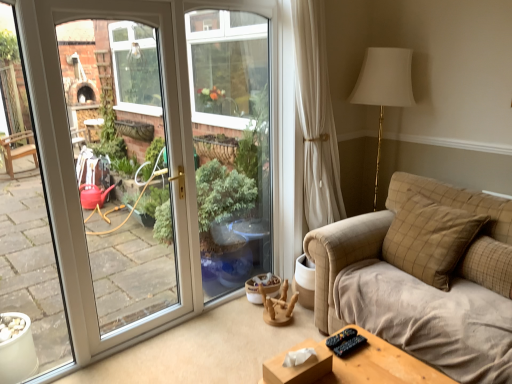
Question: Is brown checkered pillow at right, which appears as the first pillow when viewed from the right, situated inside brown velvety pillow at right, which is counted as the 1th pillow, starting from the left, or outside?

Choices:
 (A) inside
 (B) outside

Answer: (B)

Question: From a real-world perspective, is brown checkered pillow at right, positioned as the second pillow in left-to-right order, physically located above or below brown velvety pillow at right, which is the 2th pillow in right-to-left order?

Choices:
 (A) above
 (B) below

Answer: (B)

Question: Based on their sizes in the image, would you say brown checkered pillow at right, positioned as the second pillow in left-to-right order, is bigger or smaller than brown velvety pillow at right, which is the 2th pillow in right-to-left order?

Choices:
 (A) big
 (B) small

Answer: (B)

Question: From a real-world perspective, is brown velvety pillow at right, which is the 2th pillow in right-to-left order, positioned above or below brown checkered pillow at right, which appears as the first pillow when viewed from the right?

Choices:
 (A) below
 (B) above

Answer: (B)

Question: Is brown velvety pillow at right, which is the 2th pillow in right-to-left order, wider or thinner than brown checkered pillow at right, positioned as the second pillow in left-to-right order?

Choices:
 (A) thin
 (B) wide

Answer: (B)

Question: Is brown velvety pillow at right, which is counted as the 1th pillow, starting from the left, in front of or behind brown checkered pillow at right, positioned as the second pillow in left-to-right order, in the image?

Choices:
 (A) behind
 (B) front

Answer: (A)

Question: Is brown velvety pillow at right, which is the 2th pillow in right-to-left order, to the left or to the right of brown checkered pillow at right, positioned as the second pillow in left-to-right order, in the image?

Choices:
 (A) left
 (B) right

Answer: (A)